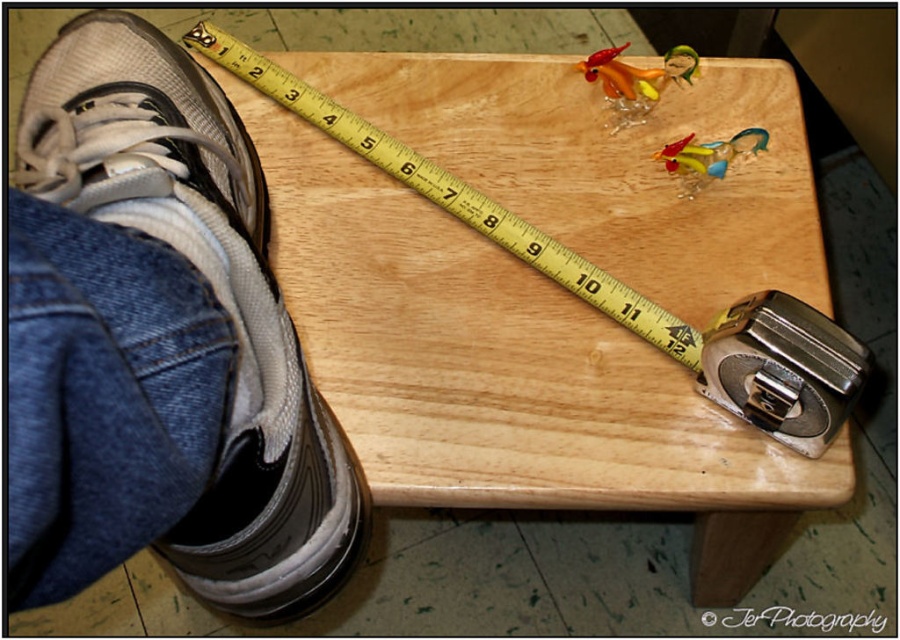
Does yellow/yellowish wood ruler at upper center have a greater width compared to translucent glass figurine at upper right?

Yes, yellow/yellowish wood ruler at upper center is wider than translucent glass figurine at upper right.

Between point (292, 109) and point (655, 84), which one is positioned behind?

Positioned behind is point (655, 84).

At what (x,y) coordinates should I click in order to perform the action: click on yellow/yellowish wood ruler at upper center. Please return your answer as a coordinate pair (x, y). Looking at the image, I should click on (452, 195).

Does white mesh shoe at lower left appear on the right side of wooden at upper center?

No, white mesh shoe at lower left is not to the right of wooden at upper center.

Who is taller, white mesh shoe at lower left or wooden at upper center?

wooden at upper center

What are the coordinates of `white mesh shoe at lower left` in the screenshot? It's located at (194, 305).

Measure the distance from wooden at upper center to yellow/yellowish wood ruler at upper center.

The distance of wooden at upper center from yellow/yellowish wood ruler at upper center is 2.32 inches.

Who is lower down, wooden at upper center or yellow/yellowish wood ruler at upper center?

wooden at upper center

The image size is (900, 640). I want to click on wooden at upper center, so click(x=612, y=284).

You are a GUI agent. You are given a task and a screenshot of the screen. Output one action in this format:
    pyautogui.click(x=<x>, y=<y>)
    Task: Click on the wooden at upper center
    
    Given the screenshot: What is the action you would take?
    pyautogui.click(x=612, y=284)